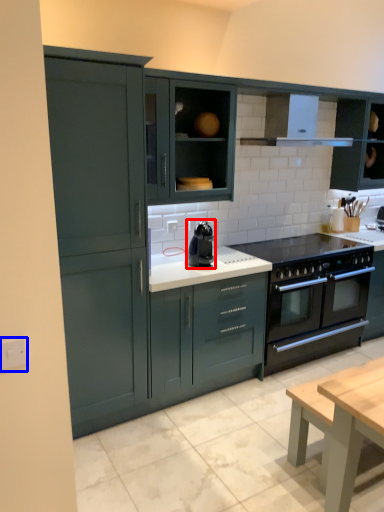
Question: Among these objects, which one is nearest to the camera, kitchen appliance (highlighted by a red box) or electric outlet (highlighted by a blue box)?

Choices:
 (A) kitchen appliance
 (B) electric outlet

Answer: (B)